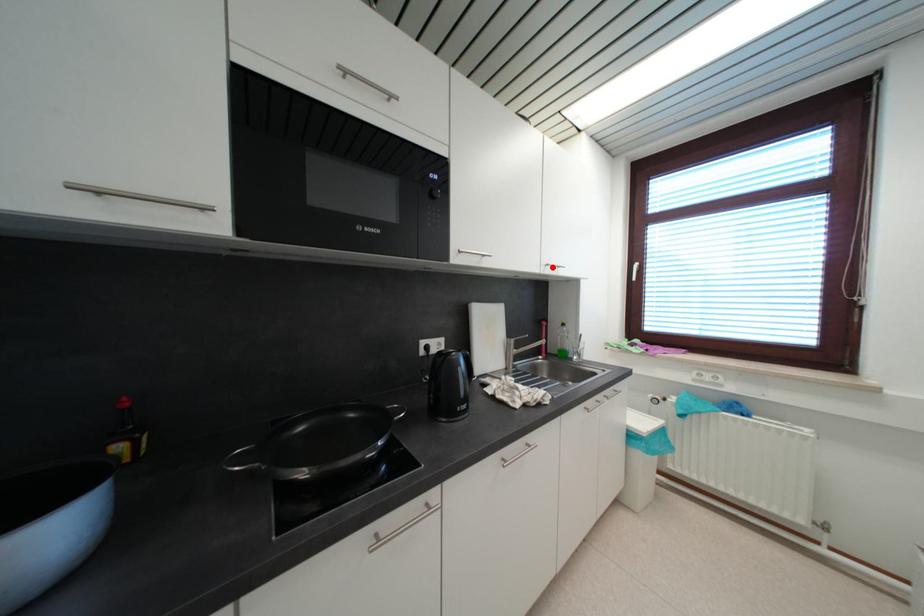
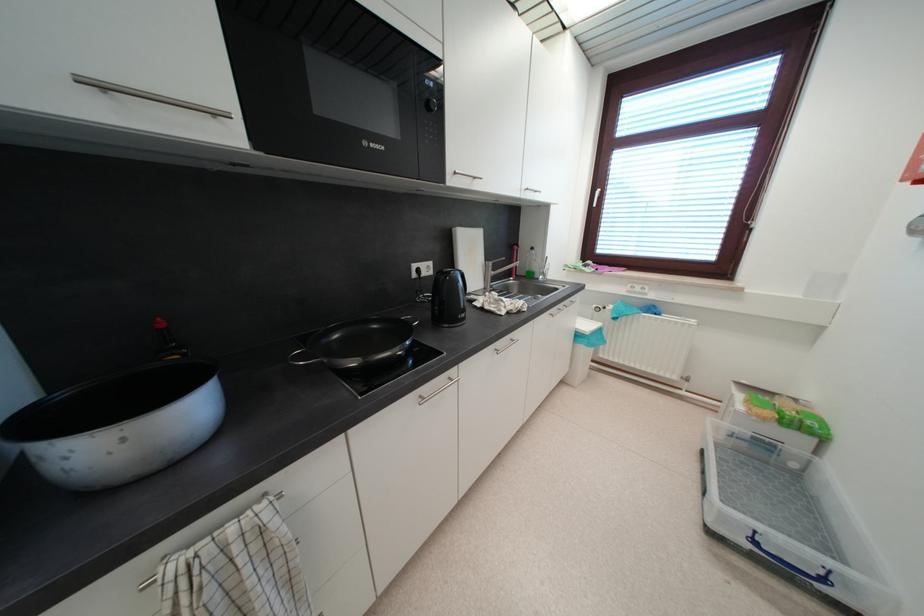
Question: I am providing you with two images of the same scene from different viewpoints. A red point is marked on the first image. At the location where the point appears in image 1, is it still visible in image 2?

Choices:
 (A) Yes
 (B) No

Answer: (A)